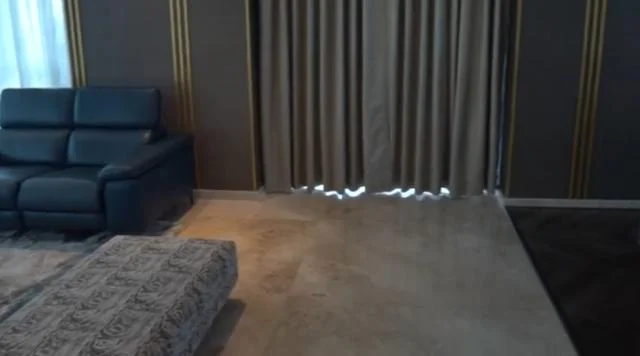
Identify the location of rug. Image resolution: width=640 pixels, height=356 pixels. (57, 255).